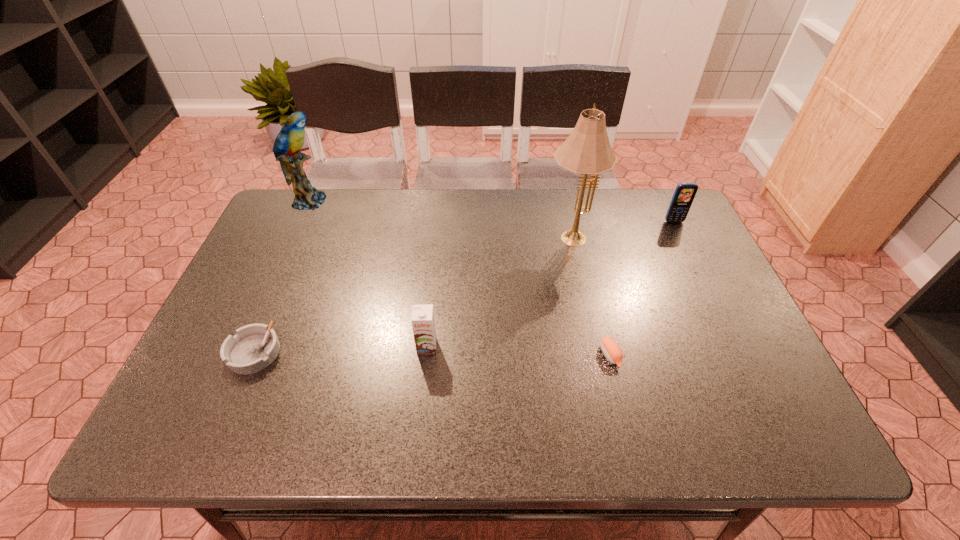
This screenshot has width=960, height=540. Identify the location of object that is at the far right corner. (684, 194).

In order to click on vacant space at the far edge of the desktop in this screenshot , I will do `click(349, 199)`.

In order to click on free region at the near edge of the desktop in this screenshot , I will do `click(499, 416)`.

This screenshot has width=960, height=540. In the image, there is a desktop. Identify the location of vacant space at the left edge. (202, 355).

Locate an element on the screen. This screenshot has height=540, width=960. free spot at the right edge of the desktop is located at coordinates (653, 244).

At what (x,y) coordinates should I click in order to perform the action: click on blank space at the far right corner. Please return your answer as a coordinate pair (x, y). The height and width of the screenshot is (540, 960). Looking at the image, I should click on (672, 226).

The width and height of the screenshot is (960, 540). In order to click on free space between the lampshade and the farthest object in this screenshot , I will do `click(440, 218)`.

Image resolution: width=960 pixels, height=540 pixels. In order to click on unoccupied position between the second tallest object and the rightmost object in this screenshot , I will do `click(492, 212)`.

Locate an element on the screen. vacant point located between the lampshade and the cellular telephone is located at coordinates (622, 228).

Image resolution: width=960 pixels, height=540 pixels. Find the location of `free point between the chocolate milk and the parrot`. free point between the chocolate milk and the parrot is located at coordinates (368, 274).